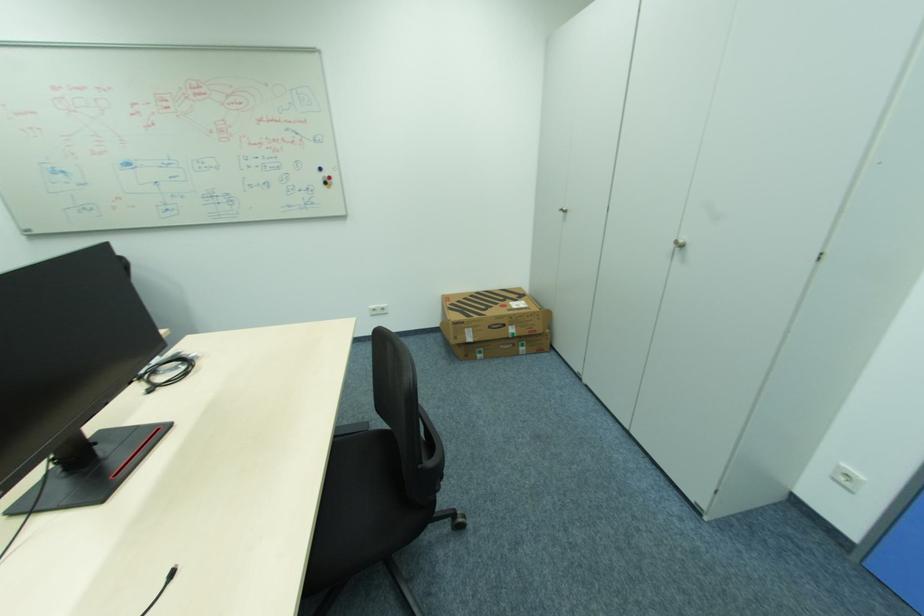
This screenshot has width=924, height=616. In order to click on chair sitting surface in this screenshot , I will do `click(359, 484)`.